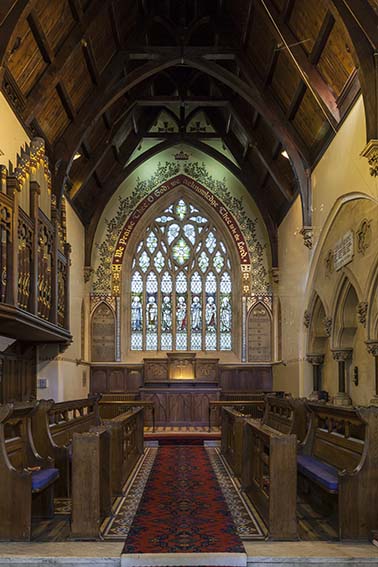
Identify the location of marble surface. This screenshot has height=567, width=378. click(x=291, y=549).